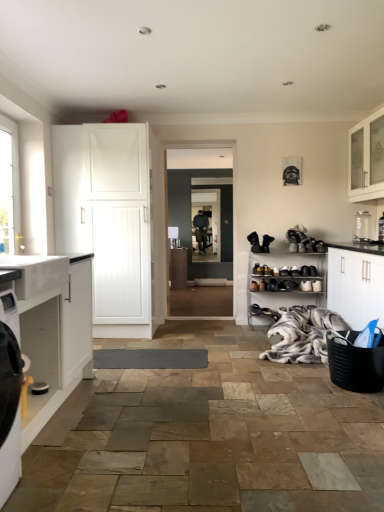
Question: Is shiny black shoe at center, acting as the fifth shoe starting from the right, oriented towards black leather shoe at center?

Choices:
 (A) yes
 (B) no

Answer: (B)

Question: From the image's perspective, does shiny black shoe at center, acting as the fifth shoe starting from the right, appear lower than black leather shoe at center?

Choices:
 (A) yes
 (B) no

Answer: (B)

Question: Is shiny black shoe at center, arranged as the 3th shoe when viewed from the left, to the right of black leather shoe at center from the viewer's perspective?

Choices:
 (A) no
 (B) yes

Answer: (B)

Question: Is shiny black shoe at center, arranged as the 3th shoe when viewed from the left, placed right next to black leather shoe at center?

Choices:
 (A) no
 (B) yes

Answer: (A)

Question: Does shiny black shoe at center, acting as the fifth shoe starting from the right, appear on the left side of black leather shoe at center?

Choices:
 (A) no
 (B) yes

Answer: (A)

Question: In terms of size, does white matte cabinet at left, the sixth cabinetry from the back, appear bigger or smaller than black leather shoe at center?

Choices:
 (A) small
 (B) big

Answer: (B)

Question: Choose the correct answer: Is white matte cabinet at left, acting as the 1th cabinetry starting from the front, inside black leather shoe at center or outside it?

Choices:
 (A) inside
 (B) outside

Answer: (B)

Question: Considering the positions of white matte cabinet at left, acting as the 1th cabinetry starting from the front, and black leather shoe at center in the image, is white matte cabinet at left, acting as the 1th cabinetry starting from the front, wider or thinner than black leather shoe at center?

Choices:
 (A) thin
 (B) wide

Answer: (B)

Question: From the image's perspective, is white matte cabinet at left, acting as the 1th cabinetry starting from the front, positioned above or below black leather shoe at center?

Choices:
 (A) above
 (B) below

Answer: (A)

Question: Is point (1, 236) closer or farther from the camera than point (132, 205)?

Choices:
 (A) closer
 (B) farther

Answer: (A)

Question: In the image, is clear glass window at left on the left side or the right side of white matte cabinet at left, which is the fourth cabinetry in front-to-back order?

Choices:
 (A) right
 (B) left

Answer: (B)

Question: Is clear glass window at left in front of or behind white matte cabinet at left, positioned as the 2th cabinetry in left-to-right order, in the image?

Choices:
 (A) front
 (B) behind

Answer: (A)

Question: From a real-world perspective, is clear glass window at left above or below white matte cabinet at left, marked as the 3th cabinetry in a back-to-front arrangement?

Choices:
 (A) below
 (B) above

Answer: (B)

Question: Is white fur blanket at lower right wider or thinner than matte black shoe at lower center, the fourth shoe from the right?

Choices:
 (A) wide
 (B) thin

Answer: (A)

Question: In terms of height, does white fur blanket at lower right look taller or shorter compared to matte black shoe at lower center, positioned as the 4th shoe in left-to-right order?

Choices:
 (A) tall
 (B) short

Answer: (A)